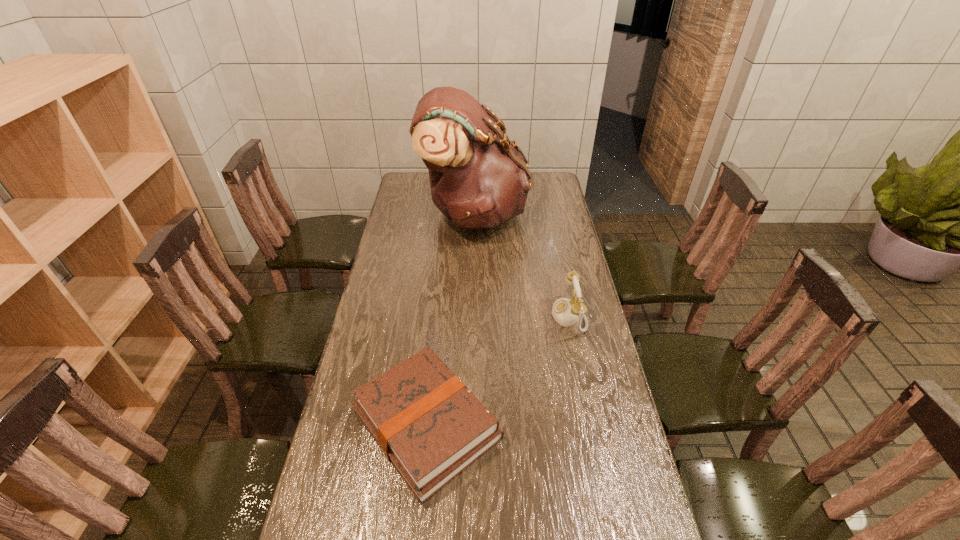
The image size is (960, 540). I want to click on vacant area that lies between the second nearest object and the satchel, so click(x=521, y=265).

Where is `free space that is in between the farthest object and the rightmost object`? free space that is in between the farthest object and the rightmost object is located at coordinates (521, 265).

Locate an element on the screen. This screenshot has height=540, width=960. free space between the hardback book and the second nearest object is located at coordinates (497, 370).

Where is `unoccupied area between the farthest object and the nearest object`? This screenshot has width=960, height=540. unoccupied area between the farthest object and the nearest object is located at coordinates (450, 319).

Choose which object is the nearest neighbor to the nearest object. Please provide its 2D coordinates. Your answer should be formatted as a tuple, i.e. [(x, y)], where the tuple contains the x and y coordinates of a point satisfying the conditions above.

[(565, 312)]

Identify the location of object that stands as the second closest to the satchel. The width and height of the screenshot is (960, 540). (428, 424).

This screenshot has height=540, width=960. I want to click on free location that satisfies the following two spatial constraints: 1. at the front of the farthest object with buckles; 2. on the front side of the hardback book, so click(470, 424).

Where is `vacant space that satisfies the following two spatial constraints: 1. on the dial of the rightmost object; 2. on the front side of the nearest object`? vacant space that satisfies the following two spatial constraints: 1. on the dial of the rightmost object; 2. on the front side of the nearest object is located at coordinates (591, 424).